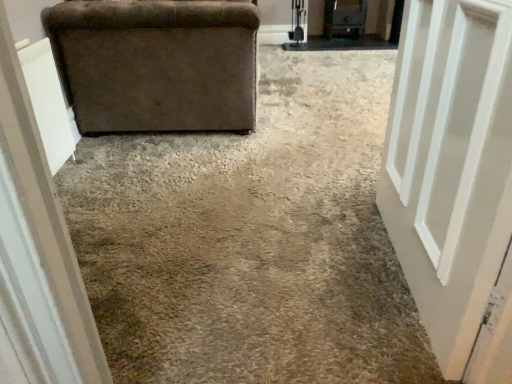
Locate an element on the screen. The image size is (512, 384). brown fabric couch at upper left is located at coordinates (251, 239).

Find the location of a particular element. velvet brown armchair at left is located at coordinates (156, 64).

Is velvet brown armchair at left oriented towards brown fabric couch at upper left?

Yes, velvet brown armchair at left faces towards brown fabric couch at upper left.

How many degrees apart are the facing directions of velvet brown armchair at left and brown fabric couch at upper left?

velvet brown armchair at left and brown fabric couch at upper left are facing 91 degrees away from each other.

Which is behind, point (159, 111) or point (223, 142)?

The point (223, 142) is behind.

Which of these two, white painted wood door at right or brown fabric couch at upper left, is bigger?

brown fabric couch at upper left is bigger.

Could brown fabric couch at upper left be considered to be inside white painted wood door at right?

No, brown fabric couch at upper left is located outside of white painted wood door at right.

Does white painted wood door at right turn towards brown fabric couch at upper left?

No, white painted wood door at right is not facing towards brown fabric couch at upper left.

Is white painted wood door at right far away from brown fabric couch at upper left?

white painted wood door at right is actually quite close to brown fabric couch at upper left.

Between velvet brown armchair at left and white painted wood door at right, which one has larger size?

velvet brown armchair at left is bigger.

Based on the photo, is velvet brown armchair at left placed right next to white painted wood door at right?

No, velvet brown armchair at left is not with white painted wood door at right.

The height and width of the screenshot is (384, 512). I want to click on door above the velvet brown armchair at left (from a real-world perspective), so click(x=450, y=165).

Looking at their sizes, would you say velvet brown armchair at left is wider or thinner than white painted wood door at right?

Considering their sizes, velvet brown armchair at left looks broader than white painted wood door at right.

Is brown fabric couch at upper left not inside white painted wood door at right?

That's correct, brown fabric couch at upper left is outside of white painted wood door at right.

Looking at this image, from a real-world perspective, is brown fabric couch at upper left physically below white painted wood door at right?

Indeed, from a real-world perspective, brown fabric couch at upper left is positioned beneath white painted wood door at right.

Visually, is brown fabric couch at upper left positioned to the left or to the right of white painted wood door at right?

Based on their positions, brown fabric couch at upper left is located to the left of white painted wood door at right.

Which point is more forward, (190, 317) or (411, 231)?

Point (190, 317)

Is white painted wood door at right at the left side of velvet brown armchair at left?

No.

From the image's perspective, does white painted wood door at right appear lower than velvet brown armchair at left?

Correct, white painted wood door at right appears lower than velvet brown armchair at left in the image.

Is white painted wood door at right not close to velvet brown armchair at left?

Yes, white painted wood door at right and velvet brown armchair at left are located far from each other.

From a real-world perspective, who is located lower, white painted wood door at right or velvet brown armchair at left?

velvet brown armchair at left is physically lower.

Which of these two, brown fabric couch at upper left or velvet brown armchair at left, stands shorter?

Standing shorter between the two is brown fabric couch at upper left.

Are brown fabric couch at upper left and velvet brown armchair at left located far from each other?

brown fabric couch at upper left is near velvet brown armchair at left, not far away.

From a real-world perspective, is brown fabric couch at upper left over velvet brown armchair at left?

No.

What are the coordinates of `furniture on the left of brown fabric couch at upper left` in the screenshot? It's located at (156, 64).

You are a GUI agent. You are given a task and a screenshot of the screen. Output one action in this format:
    pyautogui.click(x=<x>, y=<y>)
    Task: Click on the furniture behind the brown fabric couch at upper left
    The height and width of the screenshot is (384, 512).
    Given the screenshot: What is the action you would take?
    click(156, 64)

Locate an element on the screen. The width and height of the screenshot is (512, 384). door that is on the right side of brown fabric couch at upper left is located at coordinates (450, 165).

Considering their positions, is brown fabric couch at upper left positioned further to white painted wood door at right than velvet brown armchair at left?

Based on the image, velvet brown armchair at left appears to be further to white painted wood door at right.

Which object lies further to the anchor point velvet brown armchair at left, white painted wood door at right or brown fabric couch at upper left?

white painted wood door at right is further to velvet brown armchair at left.

Estimate the real-world distances between objects in this image. Which object is further from white painted wood door at right, velvet brown armchair at left or brown fabric couch at upper left?

velvet brown armchair at left.

When comparing their distances from brown fabric couch at upper left, does white painted wood door at right or velvet brown armchair at left seem further?

Among the two, white painted wood door at right is located further to brown fabric couch at upper left.

Looking at the image, which one is located further to brown fabric couch at upper left, velvet brown armchair at left or white painted wood door at right?

Among the two, white painted wood door at right is located further to brown fabric couch at upper left.

Based on their spatial positions, is brown fabric couch at upper left or white painted wood door at right further from velvet brown armchair at left?

white painted wood door at right is positioned further to the anchor velvet brown armchair at left.

Image resolution: width=512 pixels, height=384 pixels. What are the coordinates of `concrete between white painted wood door at right and velvet brown armchair at left from front to back` in the screenshot? It's located at (251, 239).